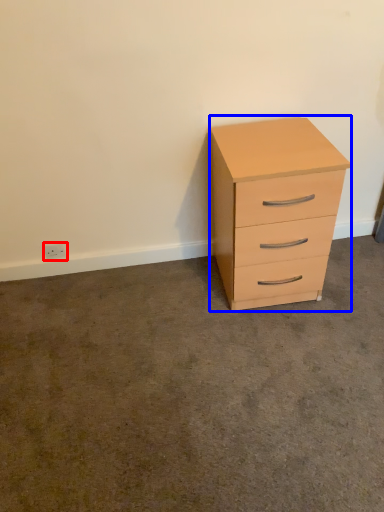
Question: Which of the following is the farthest to the observer, electric outlet (highlighted by a red box) or chest of drawers (highlighted by a blue box)?

Choices:
 (A) electric outlet
 (B) chest of drawers

Answer: (A)